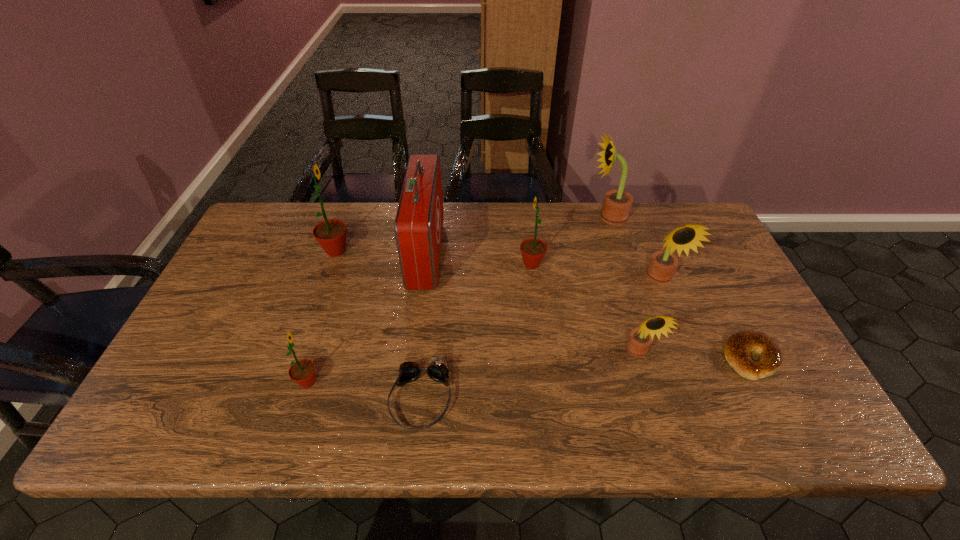
Select which yellow sunflower is the third closest to the shortest object. Please provide its 2D coordinates. Your answer should be formatted as a tuple, i.e. [(x, y)], where the tuple contains the x and y coordinates of a point satisfying the conditions above.

[(617, 203)]

Where is `green sunflower identified as the closest to the nearest sunflower`? green sunflower identified as the closest to the nearest sunflower is located at coordinates (331, 234).

You are a GUI agent. You are given a task and a screenshot of the screen. Output one action in this format:
    pyautogui.click(x=<x>, y=<y>)
    Task: Click on the second closest green sunflower to the biggest yellow sunflower
    Image resolution: width=960 pixels, height=540 pixels.
    Given the screenshot: What is the action you would take?
    pyautogui.click(x=331, y=234)

The height and width of the screenshot is (540, 960). Find the location of `free region that satisfies the following two spatial constraints: 1. on the side of the first-aid kit with the first aid cross symbol; 2. on the right side of the brown bagel`. free region that satisfies the following two spatial constraints: 1. on the side of the first-aid kit with the first aid cross symbol; 2. on the right side of the brown bagel is located at coordinates (413, 359).

Identify the location of blank space that satisfies the following two spatial constraints: 1. on the face of the farthest yellow sunflower; 2. through the lenses of the second shortest object. (668, 399).

Find the location of a particular element. This screenshot has height=540, width=960. blank space that satisfies the following two spatial constraints: 1. on the face of the farthest yellow sunflower; 2. on the right side of the shortest object is located at coordinates (656, 359).